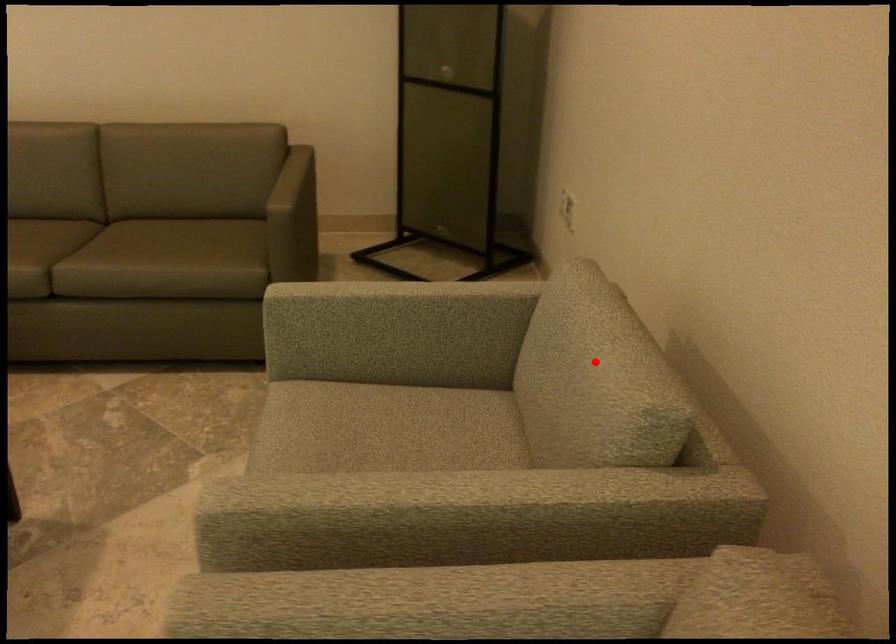
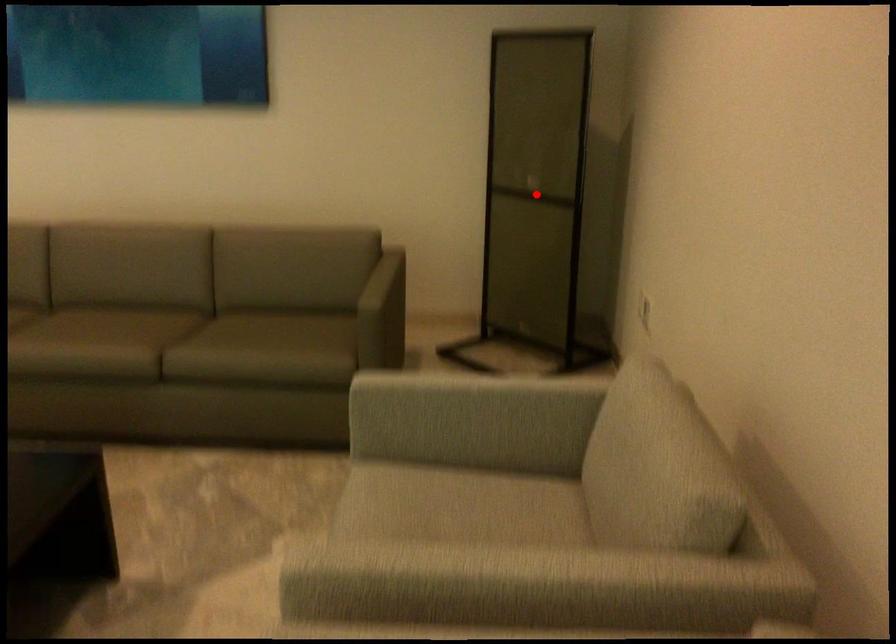
I am providing you with two images of the same scene from different viewpoints. A red point is marked on the first image and another point is marked on the second image. Is the marked point in image1 the same physical position as the marked point in image2?

No